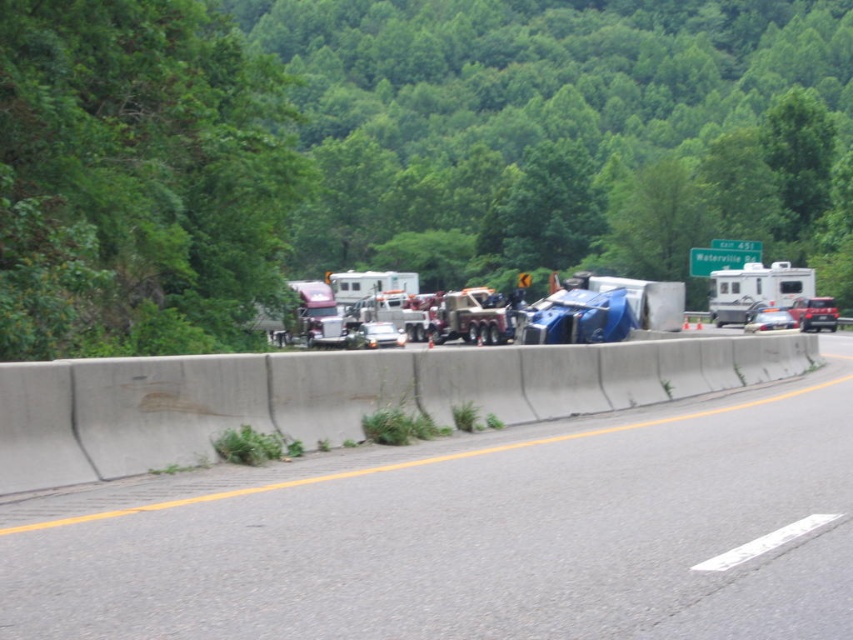
Does metallic silver suv at center have a greater width compared to metallic silver sedan at center?

Yes, metallic silver suv at center is wider than metallic silver sedan at center.

Is metallic silver suv at center behind metallic silver sedan at center?

Yes.

Describe the element at coordinates (814, 314) in the screenshot. This screenshot has width=853, height=640. I see `metallic silver suv at center` at that location.

This screenshot has width=853, height=640. Identify the location of metallic silver suv at center. (814, 314).

Does point (807, 275) come behind point (769, 310)?

That is True.

Between point (735, 305) and point (775, 323), which one is positioned in front?

Point (775, 323)

The width and height of the screenshot is (853, 640). Find the location of `white glossy rv at center`. white glossy rv at center is located at coordinates (755, 289).

Is gray concrete barrier at center wider than metallic silver sedan at center?

Yes.

Consider the image. Which is more to the right, gray concrete barrier at center or metallic silver sedan at center?

From the viewer's perspective, gray concrete barrier at center appears more on the right side.

The image size is (853, 640). Identify the location of gray concrete barrier at center. (473, 532).